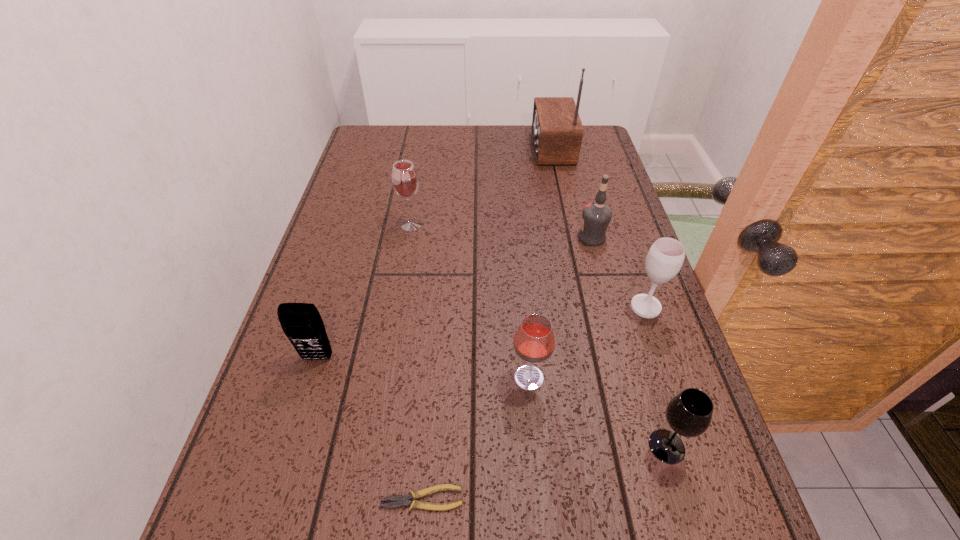
Select which object appears as the fourth closest to the second wineglass from left to right. Please provide its 2D coordinates. Your answer should be formatted as a tuple, i.e. [(x, y)], where the tuple contains the x and y coordinates of a point satisfying the conditions above.

[(301, 322)]

Locate which object is the seventh closest to the vodka. Please provide its 2D coordinates. Your answer should be formatted as a tuple, i.e. [(x, y)], where the tuple contains the x and y coordinates of a point satisfying the conditions above.

[(401, 500)]

Identify which wineglass is the nearest to the vodka. Please provide its 2D coordinates. Your answer should be formatted as a tuple, i.e. [(x, y)], where the tuple contains the x and y coordinates of a point satisfying the conditions above.

[(665, 258)]

Identify the location of the fourth closest wineglass to the cellular telephone. The width and height of the screenshot is (960, 540). (665, 258).

Find the location of `vacant space that satisfies the following two spatial constraints: 1. on the screen of the second nearest wineglass; 2. on the right side of the leftmost object`. vacant space that satisfies the following two spatial constraints: 1. on the screen of the second nearest wineglass; 2. on the right side of the leftmost object is located at coordinates [311, 377].

Where is `vacant area in the image that satisfies the following two spatial constraints: 1. on the front label of the vodka; 2. on the screen of the cellular telephone`? This screenshot has width=960, height=540. vacant area in the image that satisfies the following two spatial constraints: 1. on the front label of the vodka; 2. on the screen of the cellular telephone is located at coordinates (624, 358).

The width and height of the screenshot is (960, 540). I want to click on free location that satisfies the following two spatial constraints: 1. on the back side of the fourth farthest object; 2. on the right side of the shortest object, so click(439, 307).

At what (x,y) coordinates should I click in order to perform the action: click on vacant region that satisfies the following two spatial constraints: 1. on the front-facing side of the radio receiver; 2. on the back side of the nearest wineglass. Please return your answer as a coordinate pair (x, y). This screenshot has width=960, height=540. Looking at the image, I should click on (616, 446).

This screenshot has height=540, width=960. In order to click on vacant point that satisfies the following two spatial constraints: 1. on the front side of the nearest wineglass; 2. on the left side of the farthest wineglass in this screenshot , I will do `click(373, 446)`.

The image size is (960, 540). In order to click on free region that satisfies the following two spatial constraints: 1. on the front label of the vodka; 2. on the front side of the third farthest wineglass in this screenshot , I will do `click(630, 377)`.